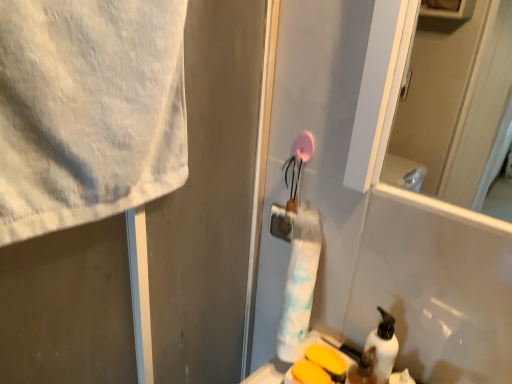
What do you see at coordinates (383, 346) in the screenshot?
I see `white matte pump bottle at lower right` at bounding box center [383, 346].

At what (x,y) coordinates should I click in order to perform the action: click on white matte pump bottle at lower right. Please return your answer as a coordinate pair (x, y). Looking at the image, I should click on (383, 346).

The width and height of the screenshot is (512, 384). Identify the location of white matte towel at upper left. (155, 241).

Would you consider translucent plastic soap dispenser at lower right to be distant from white matte towel at upper left?

translucent plastic soap dispenser at lower right is near white matte towel at upper left, not far away.

Can you confirm if translucent plastic soap dispenser at lower right is shorter than white matte towel at upper left?

Correct, translucent plastic soap dispenser at lower right is not as tall as white matte towel at upper left.

Which is in front, point (372, 381) or point (233, 163)?

Point (372, 381)

From the image's perspective, is translucent plastic soap dispenser at lower right above or below white matte towel at upper left?

translucent plastic soap dispenser at lower right is below white matte towel at upper left.

Is translucent plastic soap dispenser at lower right bigger or smaller than yellow matte soap at lower center?

Considering their sizes, translucent plastic soap dispenser at lower right takes up more space than yellow matte soap at lower center.

Would you say translucent plastic soap dispenser at lower right is to the left or to the right of yellow matte soap at lower center in the picture?

In the image, translucent plastic soap dispenser at lower right appears on the right side of yellow matte soap at lower center.

Is point (371, 349) closer to viewer compared to point (307, 369)?

Yes, it is.

Identify the location of soap below the translucent plastic soap dispenser at lower right (from a real-world perspective). This screenshot has height=384, width=512. (309, 373).

Is yellow matte soap at lower center oriented away from white matte pump bottle at lower right?

yellow matte soap at lower center does not have its back to white matte pump bottle at lower right.

Based on the photo, who is smaller, yellow matte soap at lower center or white matte pump bottle at lower right?

Smaller between the two is yellow matte soap at lower center.

Can you confirm if yellow matte soap at lower center is taller than white matte pump bottle at lower right?

No.

Which is closer, [349,379] or [381,368]?

Point [349,379] is farther from the camera than point [381,368].

Considering the sizes of translucent plastic soap dispenser at lower right and white matte pump bottle at lower right in the image, is translucent plastic soap dispenser at lower right taller or shorter than white matte pump bottle at lower right?

Considering their sizes, translucent plastic soap dispenser at lower right has less height than white matte pump bottle at lower right.

Is translucent plastic soap dispenser at lower right bigger than white matte pump bottle at lower right?

Incorrect, translucent plastic soap dispenser at lower right is not larger than white matte pump bottle at lower right.

Could you tell me if translucent plastic soap dispenser at lower right is turned towards white matte pump bottle at lower right?

Yes, translucent plastic soap dispenser at lower right is turned towards white matte pump bottle at lower right.

Locate an element on the screen. The image size is (512, 384). screen door that appears above the white matte pump bottle at lower right (from a real-world perspective) is located at coordinates (155, 241).

In the scene shown: Which is more to the right, white matte towel at upper left or white matte pump bottle at lower right?

white matte pump bottle at lower right is more to the right.

Looking at their sizes, would you say white matte towel at upper left is wider or thinner than white matte pump bottle at lower right?

white matte towel at upper left is wider than white matte pump bottle at lower right.

Where is `cleaning product above the yellow matte soap at lower center (from a real-world perspective)`? cleaning product above the yellow matte soap at lower center (from a real-world perspective) is located at coordinates (383, 346).

Which is less distant, (388, 337) or (307, 380)?

The point (388, 337) is in front.

Can you confirm if white matte pump bottle at lower right is taller than yellow matte soap at lower center?

Yes, white matte pump bottle at lower right is taller than yellow matte soap at lower center.

Is white matte pump bottle at lower right oriented away from yellow matte soap at lower center?

white matte pump bottle at lower right is not turned away from yellow matte soap at lower center.

Find the location of a particular element. The image size is (512, 384). screen door lying in front of the white matte pump bottle at lower right is located at coordinates (155, 241).

How different are the orientations of white matte pump bottle at lower right and white matte towel at upper left in degrees?

They differ by 90.1 degrees in their facing directions.

From a real-world perspective, which is physically below, white matte pump bottle at lower right or white matte towel at upper left?

white matte pump bottle at lower right.

Choose the correct answer: Is white matte pump bottle at lower right inside white matte towel at upper left or outside it?

white matte pump bottle at lower right is spatially situated outside white matte towel at upper left.

You are a GUI agent. You are given a task and a screenshot of the screen. Output one action in this format:
    pyautogui.click(x=<x>, y=<y>)
    Task: Click on the toiletry behind the white matte towel at upper left
    The image size is (512, 384).
    Given the screenshot: What is the action you would take?
    pyautogui.click(x=362, y=369)

Identify the location of toiletry positioned vertically above the yellow matte soap at lower center (from a real-world perspective). (362, 369).

Which object lies further to the anchor point white matte pump bottle at lower right, white matte towel at upper left or translucent plastic soap dispenser at lower right?

white matte towel at upper left is positioned further to the anchor white matte pump bottle at lower right.

From the image, which object appears to be farther from yellow matte soap at lower center, white matte pump bottle at lower right or translucent plastic soap dispenser at lower right?

Among the two, white matte pump bottle at lower right is located further to yellow matte soap at lower center.

Which object lies nearer to the anchor point white matte pump bottle at lower right, yellow matte soap at lower center or white matte towel at upper left?

yellow matte soap at lower center.

Looking at the image, which one is located closer to translucent plastic soap dispenser at lower right, white matte pump bottle at lower right or white matte towel at upper left?

white matte pump bottle at lower right is closer to translucent plastic soap dispenser at lower right.

Which object lies nearer to the anchor point white matte towel at upper left, white matte pump bottle at lower right or yellow matte soap at lower center?

yellow matte soap at lower center lies closer to white matte towel at upper left than the other object.

Estimate the real-world distances between objects in this image. Which object is further from translucent plastic soap dispenser at lower right, yellow matte soap at lower center or white matte towel at upper left?

white matte towel at upper left.

Which object lies further to the anchor point white matte towel at upper left, yellow matte soap at lower center or white matte pump bottle at lower right?

white matte pump bottle at lower right.

Which object lies further to the anchor point white matte pump bottle at lower right, white matte towel at upper left or yellow matte soap at lower center?

Among the two, white matte towel at upper left is located further to white matte pump bottle at lower right.

You are a GUI agent. You are given a task and a screenshot of the screen. Output one action in this format:
    pyautogui.click(x=<x>, y=<y>)
    Task: Click on the cleaning product positioned between white matte towel at upper left and yellow matte soap at lower center from near to far
    
    Given the screenshot: What is the action you would take?
    pyautogui.click(x=383, y=346)

The width and height of the screenshot is (512, 384). I want to click on toiletry situated between yellow matte soap at lower center and white matte pump bottle at lower right from left to right, so click(362, 369).

Locate an element on the screen. toiletry between white matte towel at upper left and yellow matte soap at lower center in the front-back direction is located at coordinates [x=362, y=369].

I want to click on toiletry situated between white matte towel at upper left and white matte pump bottle at lower right from left to right, so click(x=362, y=369).